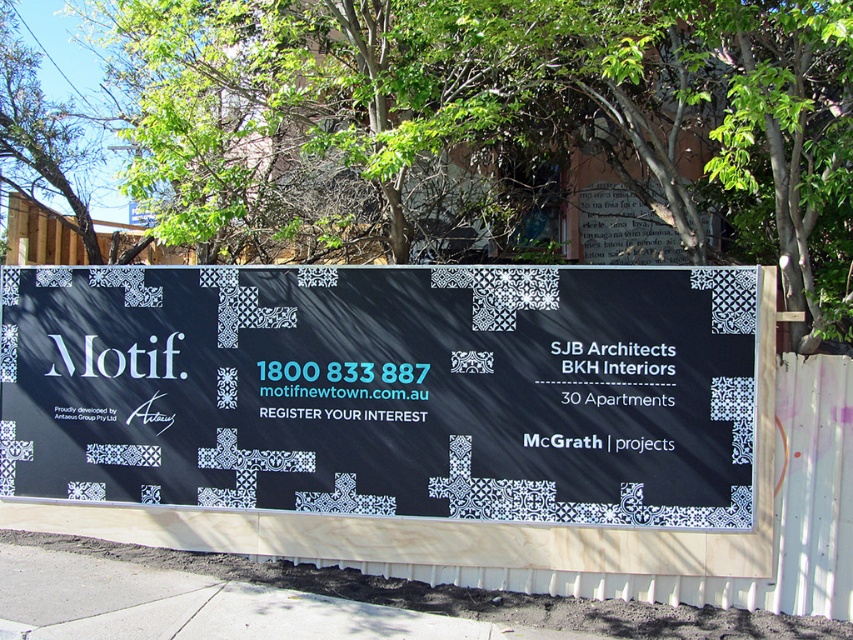
Consider the image. Can you confirm if wooden at center is thinner than concrete pavement at lower center?

Indeed, wooden at center has a lesser width compared to concrete pavement at lower center.

Between wooden at center and concrete pavement at lower center, which one appears on the left side from the viewer's perspective?

Positioned to the left is concrete pavement at lower center.

Who is more distant from viewer, (840, 394) or (126, 552)?

The point (126, 552) is behind.

Where is `wooden at center`? The image size is (853, 640). wooden at center is located at coordinates tap(775, 518).

Is black matte sign at center positioned before green leafy tree at upper center?

No, it is not.

Who is positioned more to the right, black matte sign at center or green leafy tree at upper center?

green leafy tree at upper center

Between point (177, 346) and point (264, 81), which one is positioned behind?

Point (264, 81)

In order to click on black matte sign at center in this screenshot , I will do `click(386, 390)`.

Can you confirm if black matte sign at center is shorter than wooden at center?

No.

Does point (585, 422) come closer to viewer compared to point (798, 436)?

No, (585, 422) is behind (798, 436).

Is point (292, 452) less distant than point (799, 413)?

No.

Locate an element on the screen. black matte sign at center is located at coordinates (386, 390).